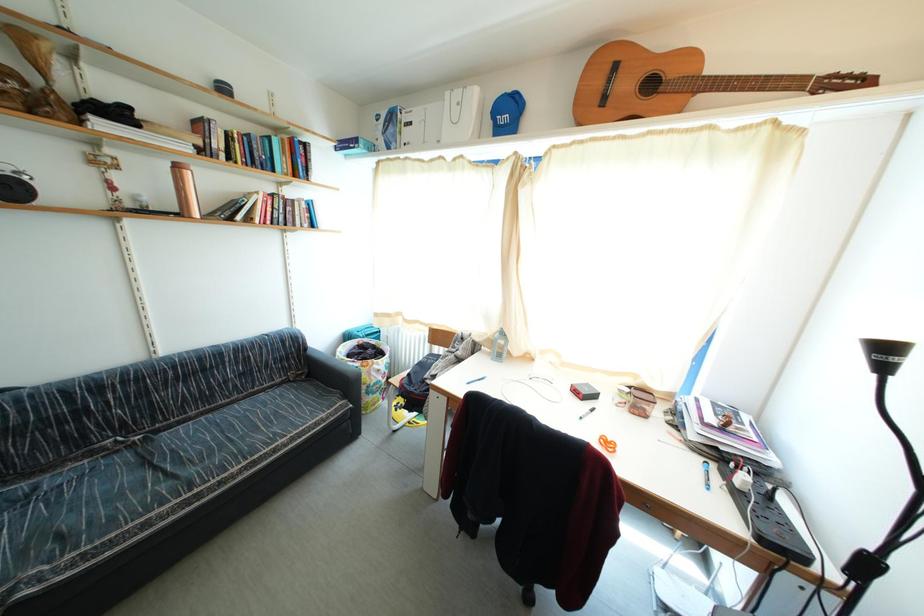
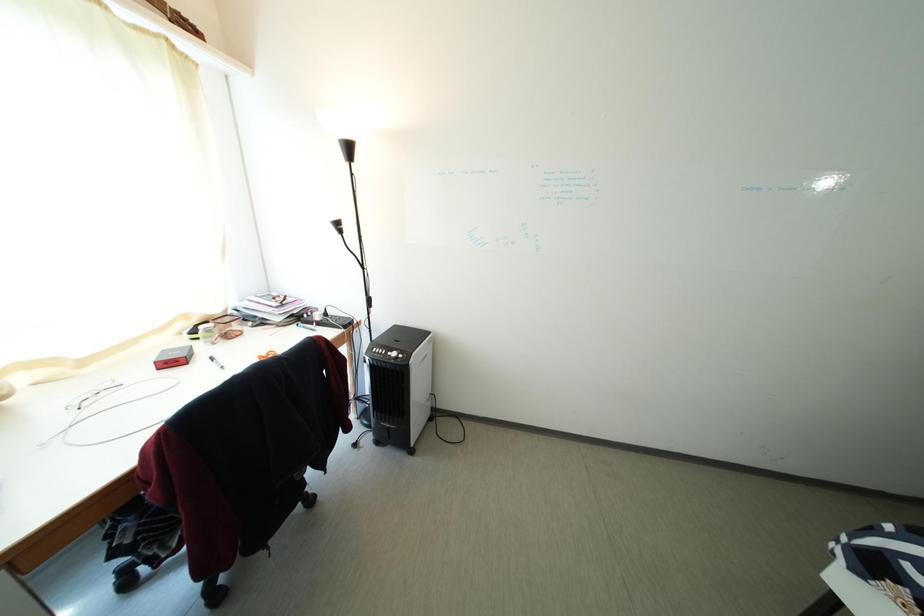
Based on the photo, the first image is from the beginning of the video and the second image is from the end. How did the camera likely rotate when shooting the video?

The rotation direction of the camera is right-down.